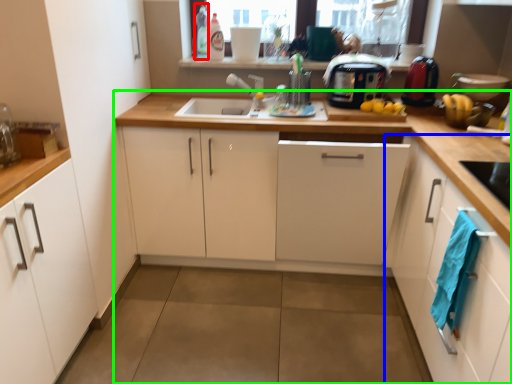
Question: Which object is the closest to the bottle (highlighted by a red box)? Choose among these: cabinetry (highlighted by a blue box) or countertop (highlighted by a green box).

Choices:
 (A) cabinetry
 (B) countertop

Answer: (B)